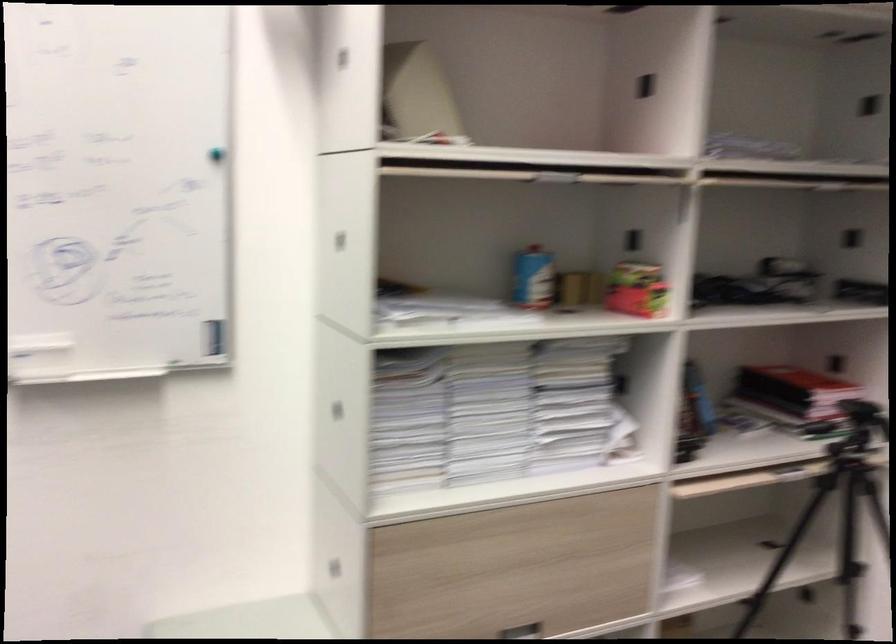
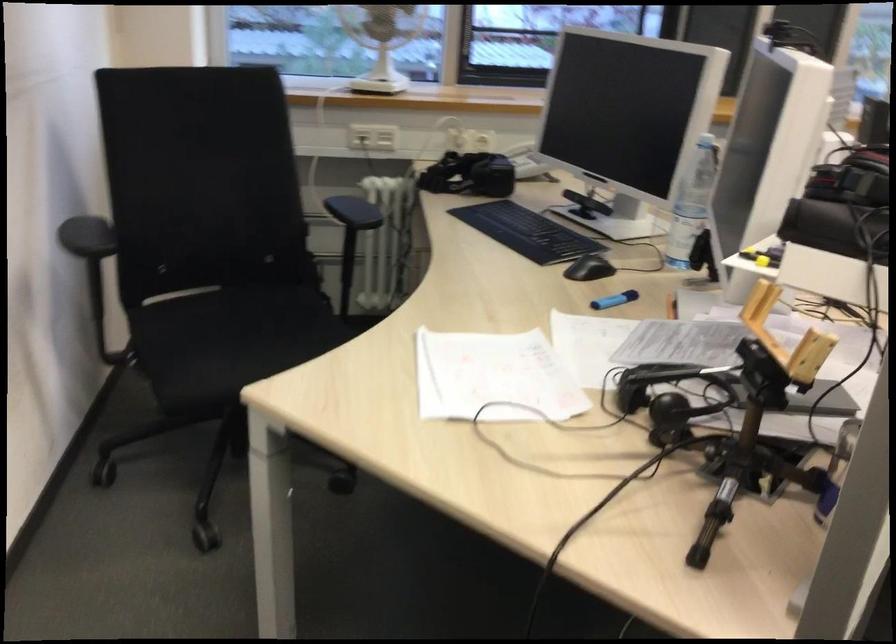
How did the camera likely rotate?

The camera's rotation is toward left-down.